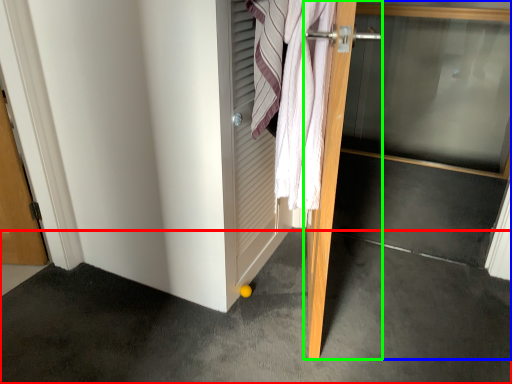
Question: Based on their relative distances, which object is farther from concrete (highlighted by a red box)? Choose from door (highlighted by a blue box) and door (highlighted by a green box).

Choices:
 (A) door
 (B) door

Answer: (A)